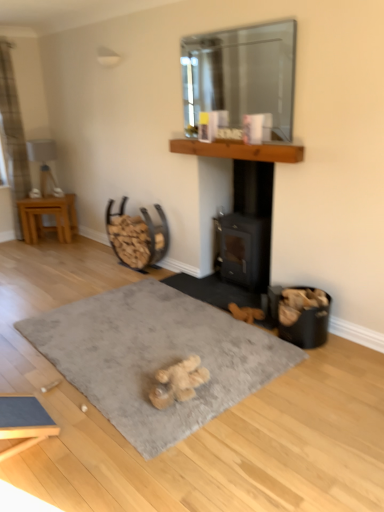
Locate an element on the screen. This screenshot has width=384, height=512. vacant region to the left of fuzzy beige teddy bear at center is located at coordinates (130, 388).